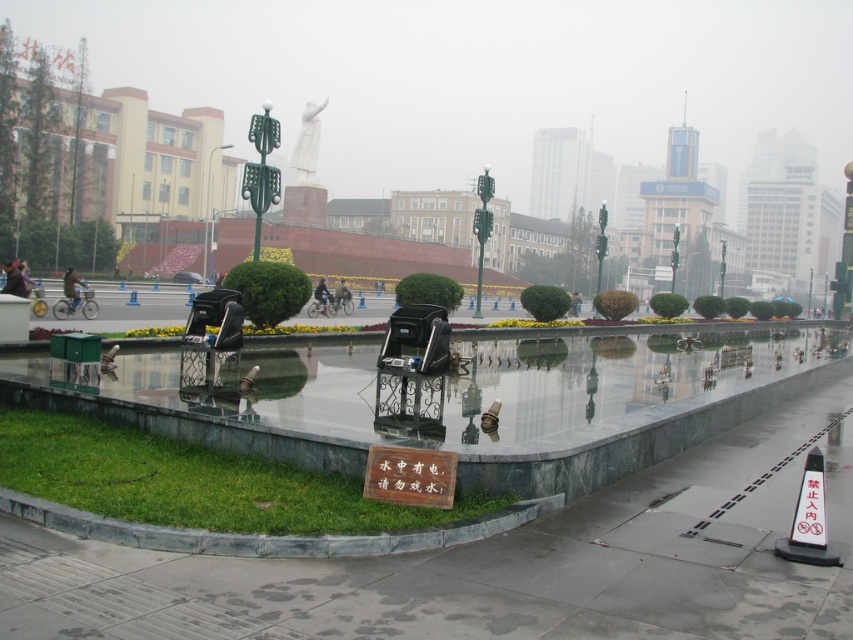
Question: Is marble pavement at center wider than green grass at lower left?

Choices:
 (A) no
 (B) yes

Answer: (B)

Question: Among these points, which one is nearest to the camera?

Choices:
 (A) (334, 300)
 (B) (20, 282)
 (C) (379, 506)
 (D) (202, 602)

Answer: (D)

Question: Among these objects, which one is nearest to the camera?

Choices:
 (A) dark blue jacket at center
 (B) dark blue jacket at lower left

Answer: (B)

Question: Is dark blue jacket at left above dark blue jacket at center?

Choices:
 (A) yes
 (B) no

Answer: (A)

Question: Can you confirm if dark blue jacket at center is positioned above dark gray jacket at center?

Choices:
 (A) no
 (B) yes

Answer: (B)

Question: Among these points, which one is nearest to the camera?

Choices:
 (A) (346, 291)
 (B) (74, 296)
 (C) (318, 284)
 (D) (788, 476)

Answer: (D)